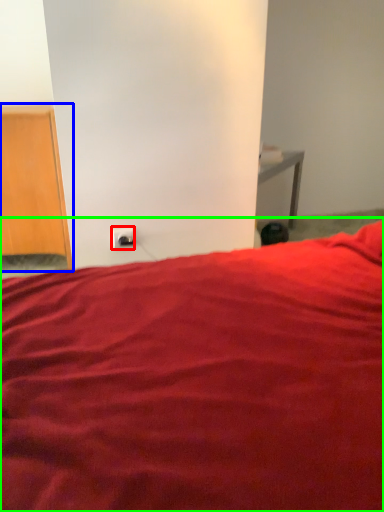
Question: Considering the real-world distances, which object is farthest from electric outlet (highlighted by a red box)? furniture (highlighted by a blue box) or bed (highlighted by a green box)?

Choices:
 (A) furniture
 (B) bed

Answer: (B)